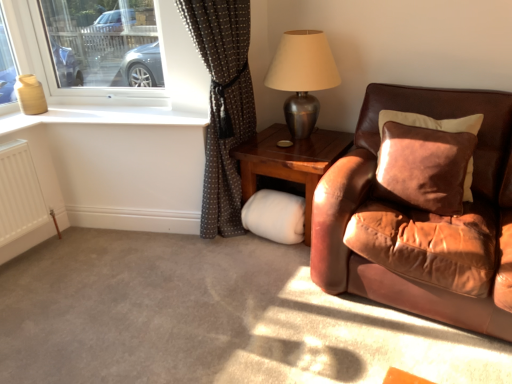
Identify the location of free space in front of brown dotted fabric at left. (220, 282).